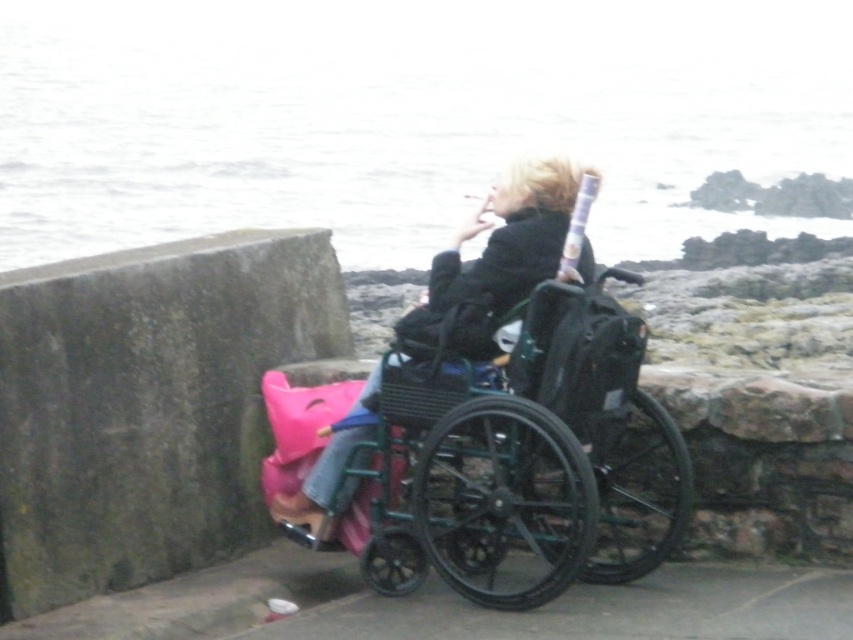
Measure the distance between white water at upper center and camera.

A distance of 4.96 meters exists between white water at upper center and camera.

What do you see at coordinates (403, 116) in the screenshot? The height and width of the screenshot is (640, 853). I see `white water at upper center` at bounding box center [403, 116].

Where is `white water at upper center`? white water at upper center is located at coordinates (403, 116).

Who is positioned more to the left, metallic green wheelchair at center or matte black wheelchair at center?

matte black wheelchair at center

Is metallic green wheelchair at center further to camera compared to matte black wheelchair at center?

No.

Which is behind, point (376, 550) or point (334, 496)?

Point (334, 496)

Locate an element on the screen. metallic green wheelchair at center is located at coordinates (523, 458).

Which is behind, point (376, 211) or point (581, 348)?

Point (376, 211)

Between white water at upper center and metallic green wheelchair at center, which one is positioned higher?

Positioned higher is white water at upper center.

Does point (183, 67) come behind point (425, 502)?

That is True.

Find the location of a particular element. This screenshot has width=853, height=640. white water at upper center is located at coordinates (403, 116).